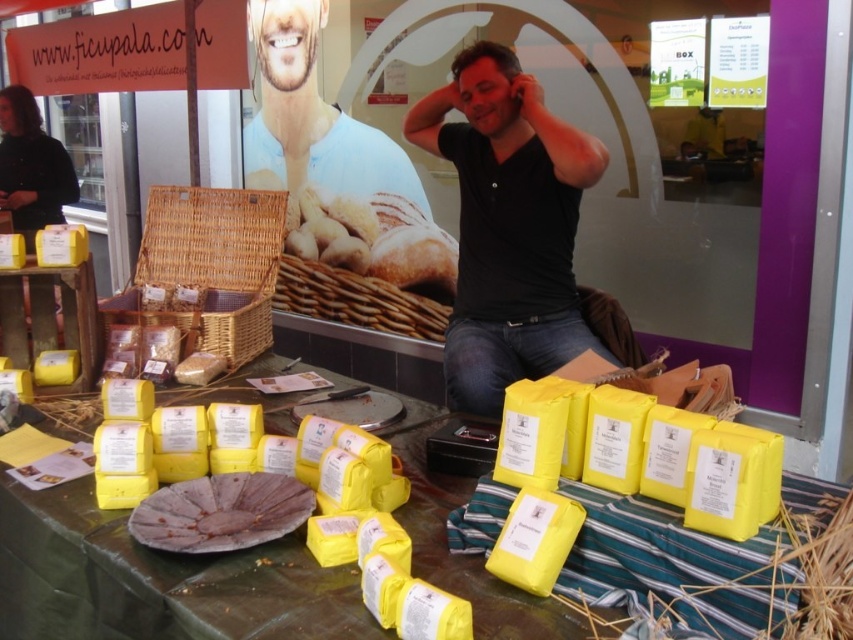
You are a customer at the market stall and want to know which item is larger between the yellow paper at center and the black matte shirt at center. Can you tell me which one is bigger?

The yellow paper at center is bigger than the black matte shirt at center according to the description.

You are a customer at the market stall and want to find the black matte shirt at center. According to the promotional poster, where should you look relative to the packages?

The black matte shirt at center is located at point (508, 225), so you should look towards the center of the table where the dark green plastic sheet is, as that is where the shirt is positioned relative to the packages.